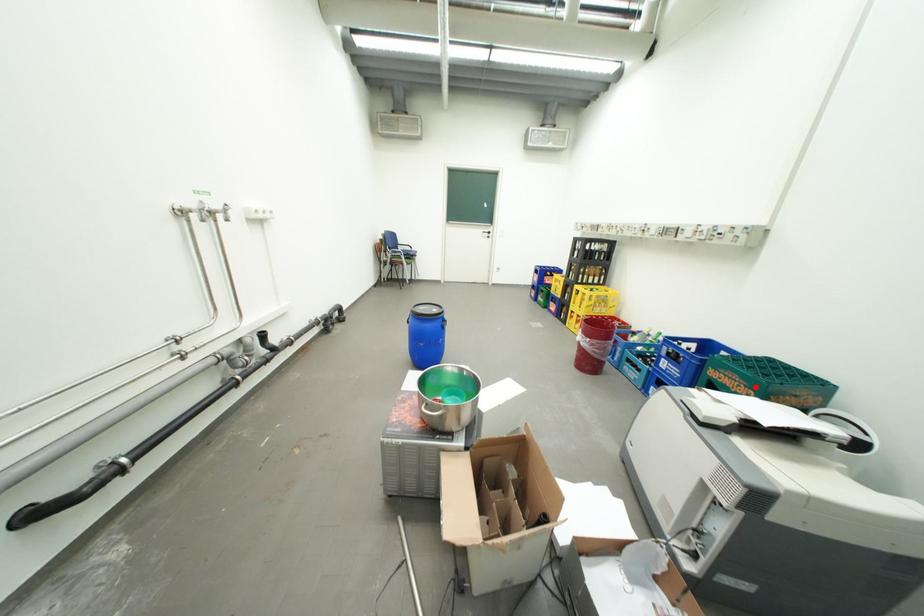
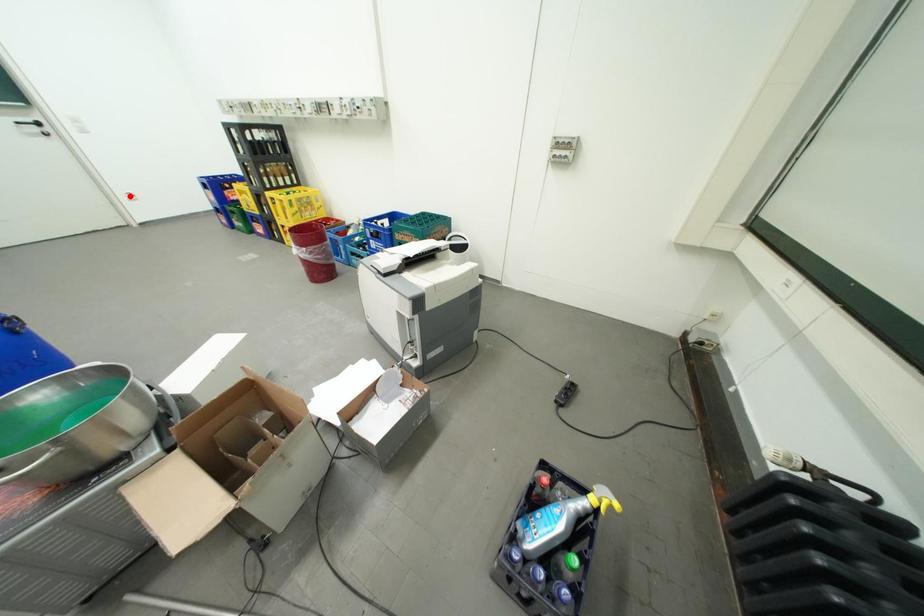
I am providing you with two images of the same scene from different viewpoints. A red point is marked on the first image and another point is marked on the second image. Do the highlighted points in image1 and image2 indicate the same real-world spot?

No